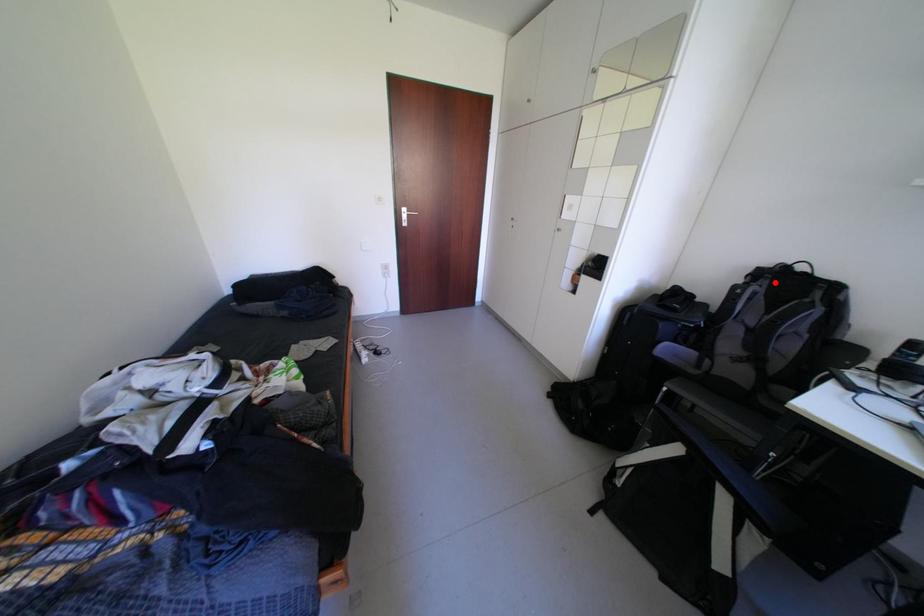
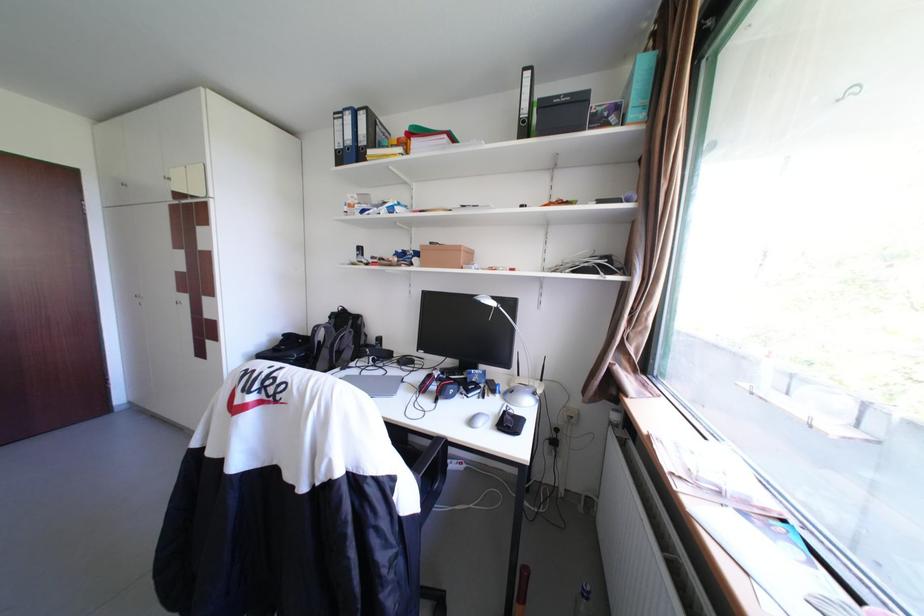
In the second image, find the point that corresponds to the highlighted location in the first image.

(344, 321)